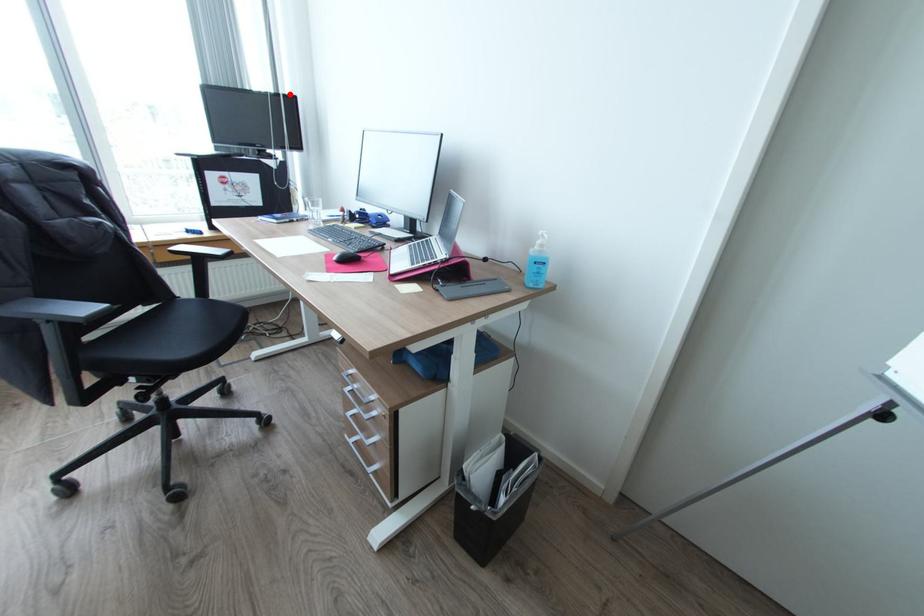
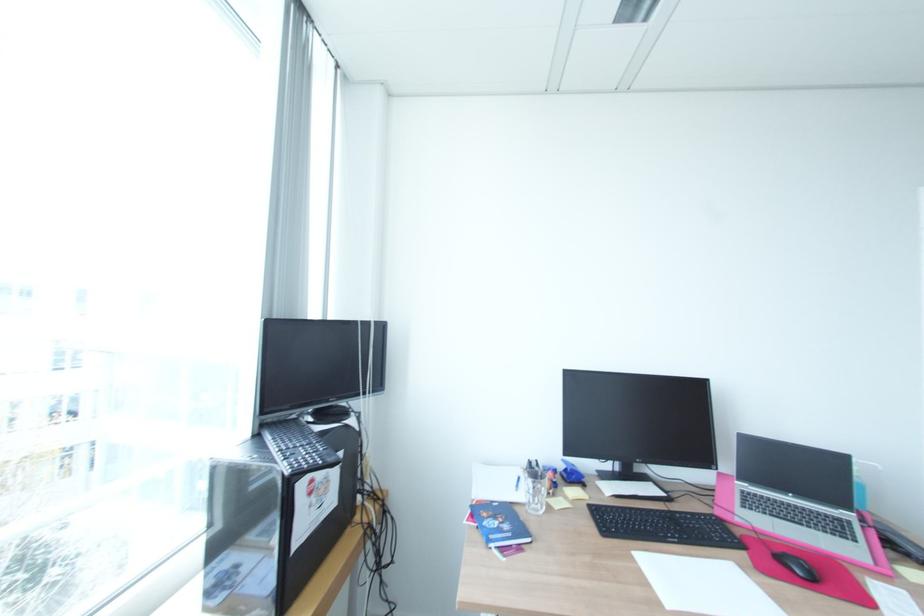
Locate, in the second image, the point that corresponds to the highlighted location in the first image.

(381, 321)